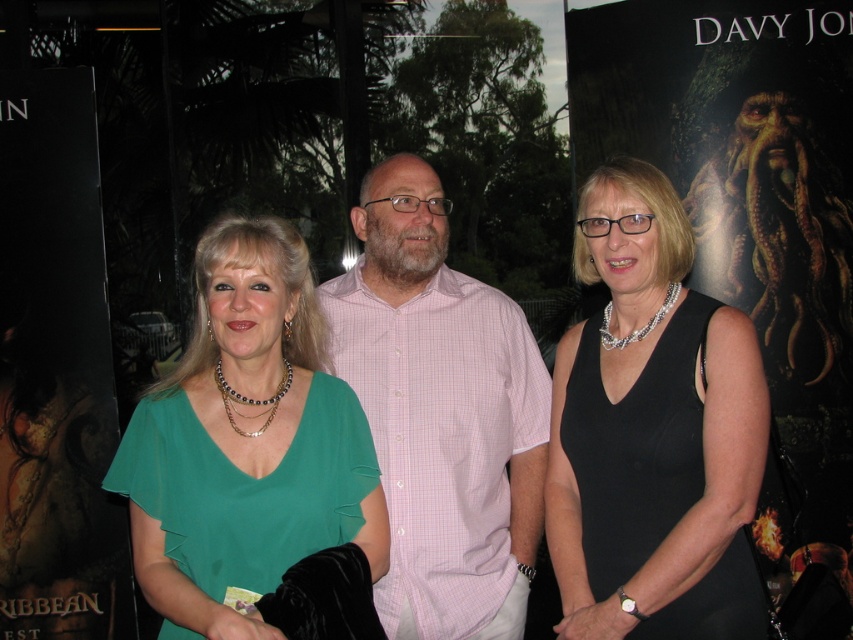
Is black satin dress at center positioned in front of green chiffon blouse at center?

No.

Who is positioned more to the right, black satin dress at center or green chiffon blouse at center?

Positioned to the right is black satin dress at center.

Between point (607, 600) and point (154, 528), which one is positioned in front?

Point (154, 528) is in front.

Where is `black satin dress at center`? The image size is (853, 640). black satin dress at center is located at coordinates [653, 433].

Locate an element on the screen. This screenshot has width=853, height=640. green chiffon blouse at center is located at coordinates (247, 442).

Looking at this image, is green chiffon blouse at center positioned in front of pink checkered shirt at center?

Yes, green chiffon blouse at center is closer to the viewer.

Is point (277, 320) more distant than point (486, 372)?

No, (277, 320) is in front of (486, 372).

The width and height of the screenshot is (853, 640). In order to click on green chiffon blouse at center in this screenshot , I will do `click(247, 442)`.

Which is behind, point (659, 372) or point (515, 481)?

The point (515, 481) is behind.

Which of these two, black satin dress at center or pink checkered shirt at center, stands shorter?

Standing shorter between the two is black satin dress at center.

The height and width of the screenshot is (640, 853). Find the location of `black satin dress at center`. black satin dress at center is located at coordinates click(x=653, y=433).